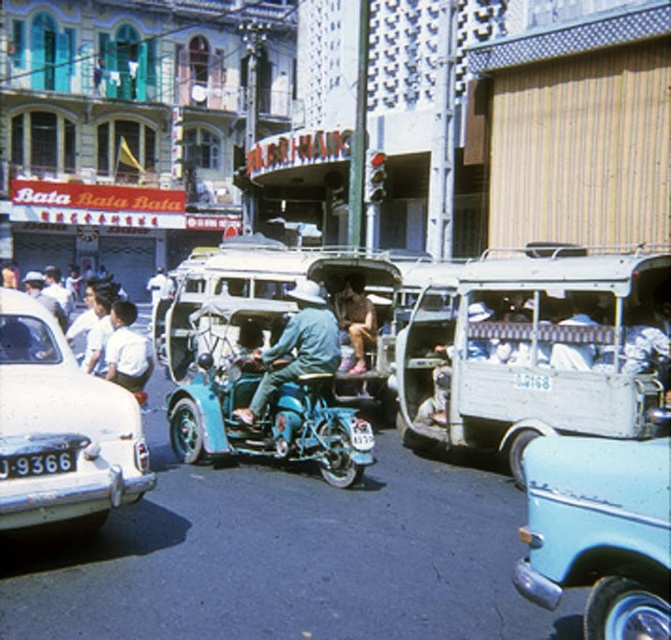
Can you confirm if light blue plastic tricycle at center is positioned below teal matte motorcycle at center?

No.

In the scene shown: Who is more forward, (515, 424) or (211, 305)?

Point (515, 424) is in front.

Describe the element at coordinates (533, 352) in the screenshot. I see `light blue plastic tricycle at center` at that location.

At what (x,y) coordinates should I click in order to perform the action: click on light blue plastic tricycle at center. Please return your answer as a coordinate pair (x, y). Looking at the image, I should click on (533, 352).

I want to click on white glossy car at lower left, so click(x=60, y=429).

Is white glossy car at lower left above teal matte motorcycle at center?

Correct, white glossy car at lower left is located above teal matte motorcycle at center.

Which is in front, point (103, 499) or point (309, 436)?

Point (103, 499) is in front.

The image size is (671, 640). Find the location of `white glossy car at lower left`. white glossy car at lower left is located at coordinates (60, 429).

Based on the photo, can you confirm if white matte shirt at center is shorter than brown leather jacket at center?

Yes, white matte shirt at center is shorter than brown leather jacket at center.

This screenshot has height=640, width=671. In order to click on white matte shirt at center in this screenshot , I will do `click(125, 349)`.

What do you see at coordinates (125, 349) in the screenshot? I see `white matte shirt at center` at bounding box center [125, 349].

Where is `white matte shirt at center`? The width and height of the screenshot is (671, 640). white matte shirt at center is located at coordinates (125, 349).